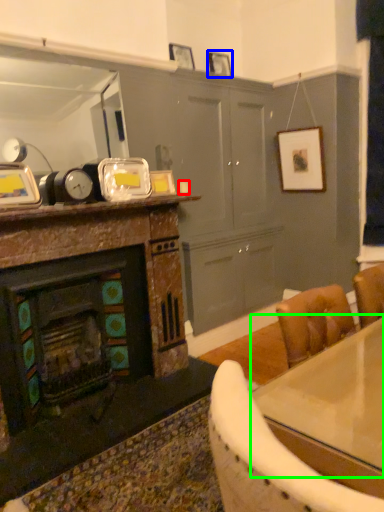
Question: Based on their relative distances, which object is farther from coffee cup (highlighted by a red box)? Choose from picture frame (highlighted by a blue box) and counter top (highlighted by a green box).

Choices:
 (A) picture frame
 (B) counter top

Answer: (B)